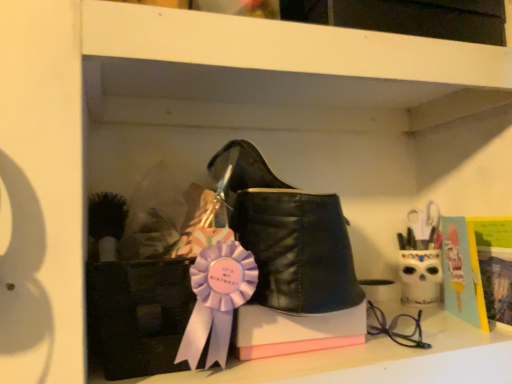
Image resolution: width=512 pixels, height=384 pixels. Identify the location of matte black glasses at lower right. tap(395, 327).

I want to click on white matte shelf at upper center, so click(x=286, y=46).

The image size is (512, 384). Find the location of `glasses below the white matte shelf at upper center (from a real-world perspective)`. glasses below the white matte shelf at upper center (from a real-world perspective) is located at coordinates (395, 327).

Is matte black glasses at lower right shorter than white matte shelf at upper center?

Indeed, matte black glasses at lower right has a lesser height compared to white matte shelf at upper center.

Between matte black glasses at lower right and white matte shelf at upper center, which one has larger width?

white matte shelf at upper center is wider.

Choose the correct answer: Is black leather boot at center inside matte black glasses at lower right or outside it?

black leather boot at center is not inside matte black glasses at lower right, it's outside.

Would you say black leather boot at center is to the left or to the right of matte black glasses at lower right in the picture?

From the image, it's evident that black leather boot at center is to the left of matte black glasses at lower right.

Considering the sizes of objects black leather boot at center and matte black glasses at lower right in the image provided, who is shorter, black leather boot at center or matte black glasses at lower right?

With less height is matte black glasses at lower right.

Is black leather boot at center wider than matte black glasses at lower right?

Indeed, black leather boot at center has a greater width compared to matte black glasses at lower right.

Between point (390, 326) and point (300, 216), which one is positioned behind?

The point (390, 326) is farther.

Looking at the image, does matte black glasses at lower right seem bigger or smaller compared to black leather boot at center?

Clearly, matte black glasses at lower right is smaller in size than black leather boot at center.

Does matte black glasses at lower right appear on the right side of black leather boot at center?

Yes.

How different are the orientations of matte black glasses at lower right and black leather boot at center in degrees?

3.36 degrees separate the facing orientations of matte black glasses at lower right and black leather boot at center.

Between white matte shelf at upper center and matte black glasses at lower right, which one has smaller width?

matte black glasses at lower right is thinner.

Consider the image. From the image's perspective, which one is positioned lower, white matte shelf at upper center or matte black glasses at lower right?

matte black glasses at lower right, from the image's perspective.

Find the location of a particular element. This screenshot has height=384, width=512. glasses that is on the right side of white matte shelf at upper center is located at coordinates (395, 327).

Which object is more forward, white matte shelf at upper center or matte black glasses at lower right?

white matte shelf at upper center is more forward.

Is white matte shelf at upper center to the left of black leather boot at center from the viewer's perspective?

In fact, white matte shelf at upper center is to the right of black leather boot at center.

Which of these two, white matte shelf at upper center or black leather boot at center, is thinner?

Thinner between the two is black leather boot at center.

Which of these two, white matte shelf at upper center or black leather boot at center, stands taller?

black leather boot at center is taller.

Between white matte shelf at upper center and black leather boot at center, which one has smaller size?

With smaller size is black leather boot at center.

Considering the sizes of objects black leather boot at center and white matte shelf at upper center in the image provided, who is bigger, black leather boot at center or white matte shelf at upper center?

white matte shelf at upper center.

Is black leather boot at center to the right of white matte shelf at upper center from the viewer's perspective?

No.

Can you tell me how much black leather boot at center and white matte shelf at upper center differ in facing direction?

They differ by 1.28 degrees in their facing directions.

The height and width of the screenshot is (384, 512). Find the location of `glasses that is on the right side of white matte shelf at upper center`. glasses that is on the right side of white matte shelf at upper center is located at coordinates (395, 327).

You are a GUI agent. You are given a task and a screenshot of the screen. Output one action in this format:
    pyautogui.click(x=<x>, y=<y>)
    Task: Click on the footwear on the left of matte black glasses at lower right
    
    Given the screenshot: What is the action you would take?
    pos(287,235)

Based on their spatial positions, is white matte shelf at upper center or black leather boot at center further from matte black glasses at lower right?

The object further to matte black glasses at lower right is white matte shelf at upper center.

Looking at the image, which one is located closer to white matte shelf at upper center, black leather boot at center or matte black glasses at lower right?

Based on the image, black leather boot at center appears to be nearer to white matte shelf at upper center.

Estimate the real-world distances between objects in this image. Which object is further from black leather boot at center, matte black glasses at lower right or white matte shelf at upper center?

matte black glasses at lower right is positioned further to the anchor black leather boot at center.

From the picture: Which object lies further to the anchor point matte black glasses at lower right, black leather boot at center or white matte shelf at upper center?

white matte shelf at upper center is further to matte black glasses at lower right.

Based on their spatial positions, is matte black glasses at lower right or black leather boot at center further from white matte shelf at upper center?

The object further to white matte shelf at upper center is matte black glasses at lower right.

From the picture: Considering their positions, is white matte shelf at upper center positioned further to black leather boot at center than matte black glasses at lower right?

matte black glasses at lower right lies further to black leather boot at center than the other object.

Identify the location of footwear between white matte shelf at upper center and matte black glasses at lower right in the vertical direction. Image resolution: width=512 pixels, height=384 pixels. click(287, 235).